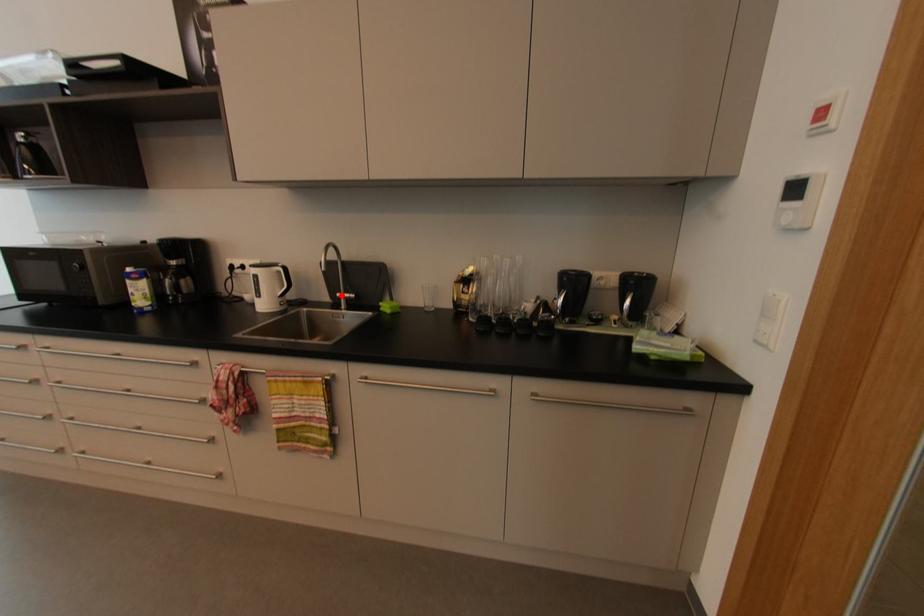
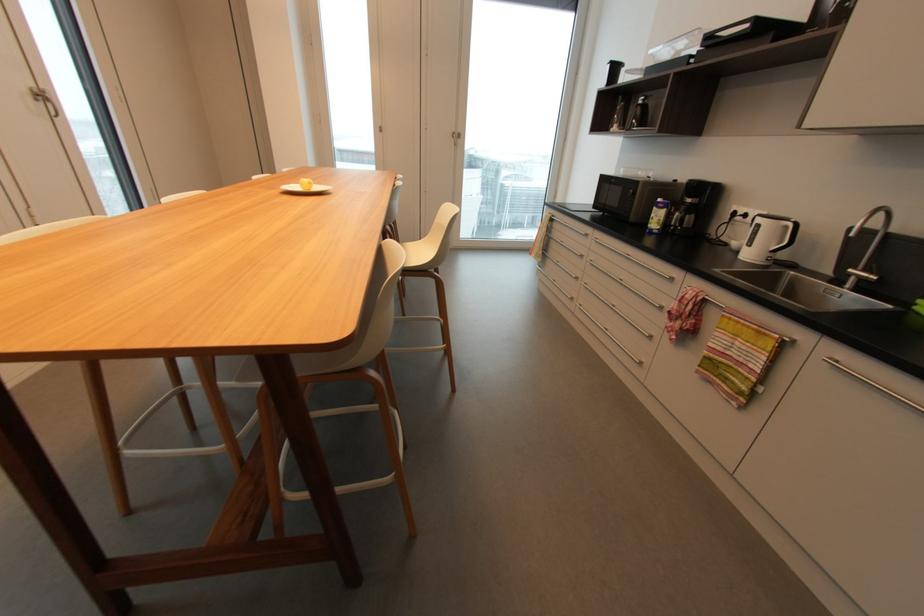
Question: I am providing you with two images of the same scene from different viewpoints. A red point is shown in image1. For the corresponding object point in image2, is it positioned nearer or farther from the camera?

Choices:
 (A) Nearer
 (B) Farther

Answer: (B)